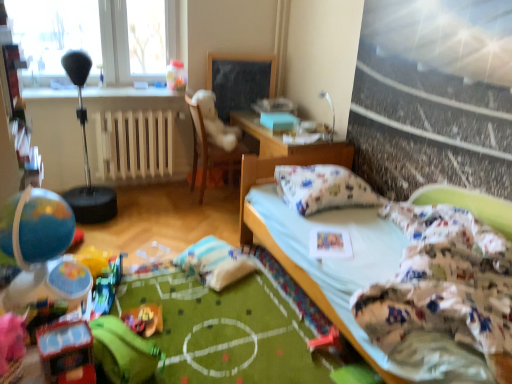
Question: Is white wooden radiator at center bigger or smaller than black chalkboard at center?

Choices:
 (A) big
 (B) small

Answer: (A)

Question: Which is correct: white wooden radiator at center is inside black chalkboard at center, or outside of it?

Choices:
 (A) inside
 (B) outside

Answer: (B)

Question: Estimate the real-world distances between objects in this image. Which object is closer to the rubber pink toy at lower center, the 1th toy from the bottom?

Choices:
 (A) shiny plastic toy car at lower left, which appears as the fourth toy when viewed from the left
 (B) wooden table at center
 (C) white fabric bed at center
 (D) plush yellow bear at center, arranged as the 3th toy when viewed from the right
 (E) transparent glass window at upper left

Answer: (C)

Question: Which object is positioned closest to the white plush bean bag chair at center?

Choices:
 (A) wooden table at center
 (B) plush yellow bear at center, the 4th toy viewed from the top
 (C) transparent glass window at upper left
 (D) white fabric bed at center
 (E) rubber pink toy at lower center, the 1th toy from the bottom

Answer: (A)